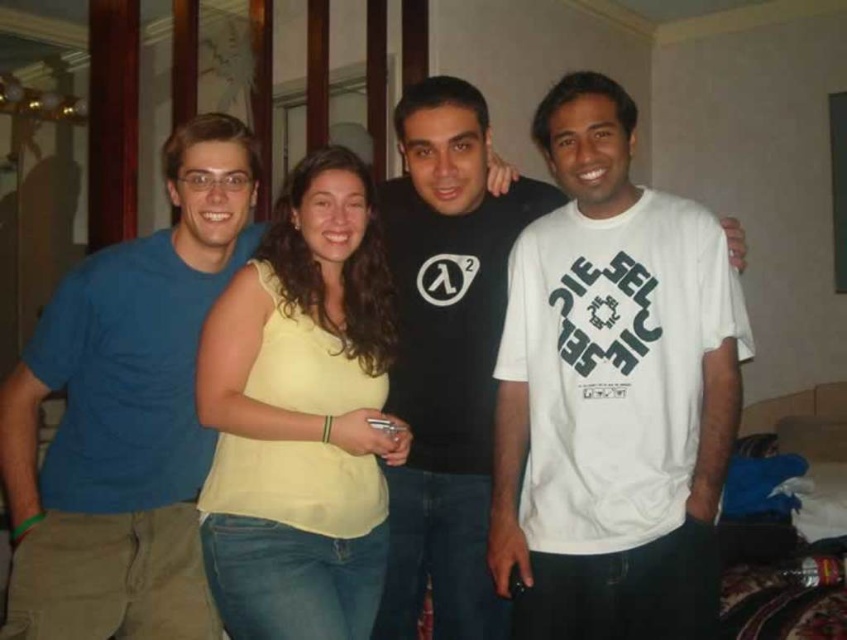
Question: Which object is the farthest from the yellow fabric shirt at center?

Choices:
 (A) black matte t-shirt at center
 (B) blue cotton t-shirt at left

Answer: (A)

Question: Among these objects, which one is farthest from the camera?

Choices:
 (A) yellow fabric shirt at center
 (B) black matte t-shirt at center
 (C) blue cotton t-shirt at left

Answer: (B)

Question: Considering the relative positions of blue cotton t-shirt at left and yellow fabric shirt at center in the image provided, where is blue cotton t-shirt at left located with respect to yellow fabric shirt at center?

Choices:
 (A) left
 (B) right

Answer: (A)

Question: Can you confirm if blue cotton t-shirt at left is positioned above black matte t-shirt at center?

Choices:
 (A) yes
 (B) no

Answer: (A)

Question: Which point appears farthest from the camera in this image?

Choices:
 (A) (108, 493)
 (B) (318, 500)
 (C) (599, 164)

Answer: (A)

Question: Does blue cotton t-shirt at left have a smaller size compared to black matte t-shirt at center?

Choices:
 (A) yes
 (B) no

Answer: (A)